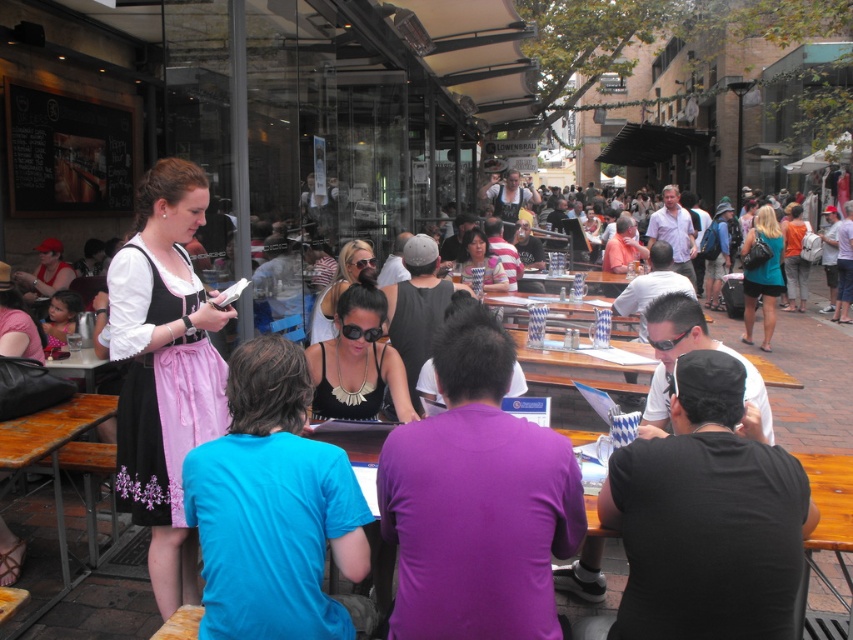
In the scene shown: Which of these two, blue cotton shirt at center or matte black dirndl at left, stands taller?

With more height is matte black dirndl at left.

Can you confirm if blue cotton shirt at center is bigger than matte black dirndl at left?

Actually, blue cotton shirt at center might be smaller than matte black dirndl at left.

Measure the distance between point [363,515] and camera.

Point [363,515] is 6.90 feet from camera.

The image size is (853, 640). Find the location of `blue cotton shirt at center`. blue cotton shirt at center is located at coordinates (271, 508).

Can you confirm if purple matte shirt at center is positioned above blue cotton shirt at center?

Correct, purple matte shirt at center is located above blue cotton shirt at center.

Is purple matte shirt at center taller than blue cotton shirt at center?

Yes, purple matte shirt at center is taller than blue cotton shirt at center.

Measure the distance between purple matte shirt at center and camera.

purple matte shirt at center and camera are 5.94 feet apart from each other.

Identify the location of purple matte shirt at center. This screenshot has width=853, height=640. (476, 500).

Who is positioned more to the right, blue cotton shirt at center or wooden table at center?

From the viewer's perspective, wooden table at center appears more on the right side.

Who is more distant from viewer, (253, 396) or (379, 436)?

Positioned behind is point (379, 436).

Describe the element at coordinates (271, 508) in the screenshot. This screenshot has width=853, height=640. I see `blue cotton shirt at center` at that location.

The width and height of the screenshot is (853, 640). I want to click on blue cotton shirt at center, so click(271, 508).